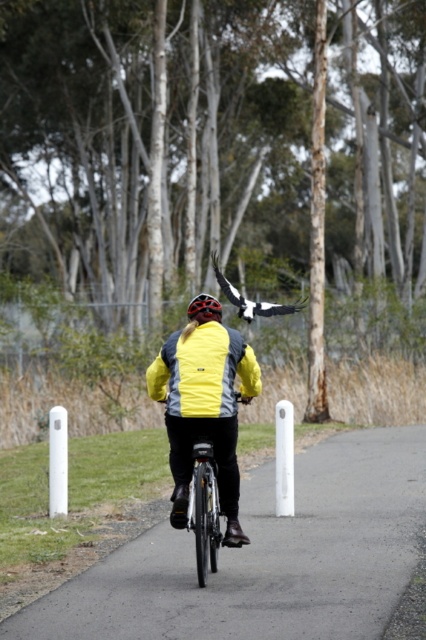
Question: From the image, what is the correct spatial relationship of asphalt road at center in relation to black glossy eagle at upper center?

Choices:
 (A) above
 (B) below

Answer: (B)

Question: Is shiny black bicycle at center closer to camera compared to black glossy eagle at upper center?

Choices:
 (A) yes
 (B) no

Answer: (A)

Question: Is yellow reflective jacket at center closer to camera compared to black glossy eagle at upper center?

Choices:
 (A) no
 (B) yes

Answer: (B)

Question: Which object is positioned farthest from the asphalt road at center?

Choices:
 (A) matte black helmet at center
 (B) yellow reflective jacket at center

Answer: (A)

Question: Considering the real-world distances, which object is farthest from the asphalt road at center?

Choices:
 (A) shiny black bicycle at center
 (B) yellow matte jacket at center
 (C) matte black helmet at center
 (D) yellow reflective jacket at center

Answer: (C)

Question: Which object is positioned farthest from the yellow matte jacket at center?

Choices:
 (A) yellow reflective jacket at center
 (B) matte black helmet at center

Answer: (B)